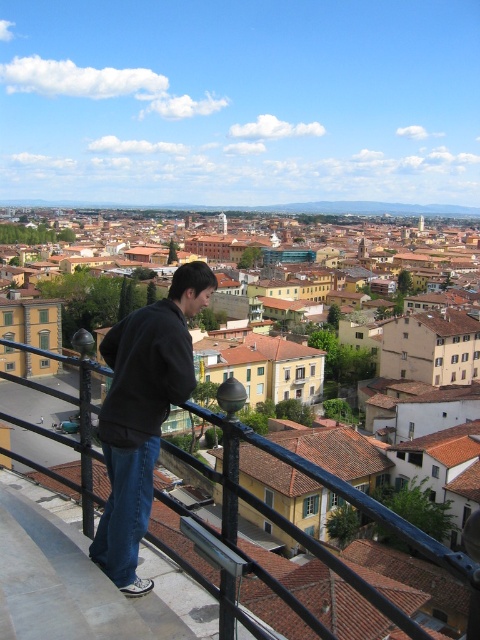
Between dark gray hoodie at center and black metal/rail at upper center, which one appears on the left side from the viewer's perspective?

dark gray hoodie at center

Does point (143, 502) lie behind point (394, 513)?

Yes, it is.

The width and height of the screenshot is (480, 640). Find the location of `dark gray hoodie at center`. dark gray hoodie at center is located at coordinates (143, 413).

Is dark gray hoodie at center thinner than denim at left?

Incorrect, dark gray hoodie at center's width is not less than denim at left's.

Is dark gray hoodie at center bigger than denim at left?

Yes, dark gray hoodie at center is bigger than denim at left.

The image size is (480, 640). What do you see at coordinates (143, 413) in the screenshot? I see `dark gray hoodie at center` at bounding box center [143, 413].

Where is `dark gray hoodie at center`? The width and height of the screenshot is (480, 640). dark gray hoodie at center is located at coordinates (143, 413).

In the scene shown: Can you confirm if black metal/rail at upper center is positioned below denim at left?

Result: No.

Looking at this image, can you confirm if black metal/rail at upper center is smaller than denim at left?

Actually, black metal/rail at upper center might be larger than denim at left.

The image size is (480, 640). Find the location of `black metal/rail at upper center`. black metal/rail at upper center is located at coordinates (337, 493).